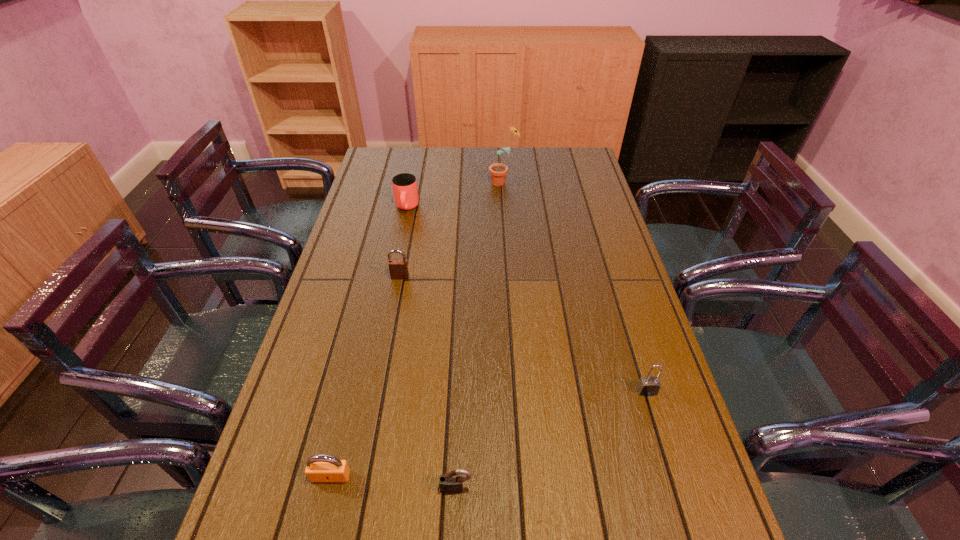
Locate an element on the screen. The width and height of the screenshot is (960, 540). free space at the far edge is located at coordinates (411, 167).

In the image, there is a desktop. At what (x,y) coordinates should I click in order to perform the action: click on vacant region at the left edge. Please return your answer as a coordinate pair (x, y). Image resolution: width=960 pixels, height=540 pixels. Looking at the image, I should click on (358, 200).

Locate an element on the screen. free region at the right edge of the desktop is located at coordinates (715, 527).

Identify the location of vacant space at the far left corner of the desktop. The height and width of the screenshot is (540, 960). (376, 161).

In the image, there is a desktop. In order to click on vacant space at the far right corner in this screenshot , I will do `click(593, 176)`.

The image size is (960, 540). What are the coordinates of `empty space between the farthest padlock and the fifth nearest object` in the screenshot? It's located at (403, 242).

The width and height of the screenshot is (960, 540). Find the location of `empty space between the farthest padlock and the rightmost object`. empty space between the farthest padlock and the rightmost object is located at coordinates (523, 334).

The image size is (960, 540). What are the coordinates of `vacant area between the sunflower and the farthest padlock` in the screenshot? It's located at (452, 230).

In order to click on unoccupied area between the fourth object from left to right and the cup in this screenshot , I will do `click(432, 348)`.

At what (x,y) coordinates should I click in order to perform the action: click on empty space that is in between the second nearest padlock and the rightmost object. Please return your answer as a coordinate pair (x, y). Looking at the image, I should click on (489, 434).